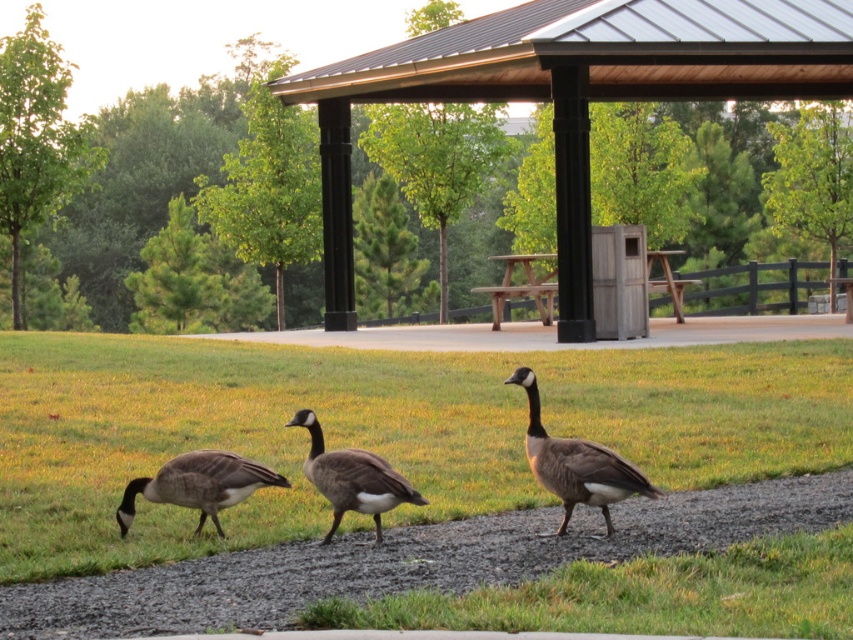
Question: Is brown matte duck at center above brown wood picnic table at center?

Choices:
 (A) yes
 (B) no

Answer: (B)

Question: Is brown wood pavilion at center in front of gray matte goose at center?

Choices:
 (A) yes
 (B) no

Answer: (B)

Question: Which object is the farthest from the gray matte goose at center?

Choices:
 (A) green grass at lower center
 (B) brown matte duck at lower left

Answer: (A)

Question: Among these points, which one is farthest from the camera?

Choices:
 (A) (122, 532)
 (B) (564, 438)

Answer: (B)

Question: Among these objects, which one is farthest from the camera?

Choices:
 (A) brown matte duck at center
 (B) green grass at lower center

Answer: (A)

Question: From the image, what is the correct spatial relationship of green grass at lower center in relation to gravel at center?

Choices:
 (A) right
 (B) left

Answer: (B)